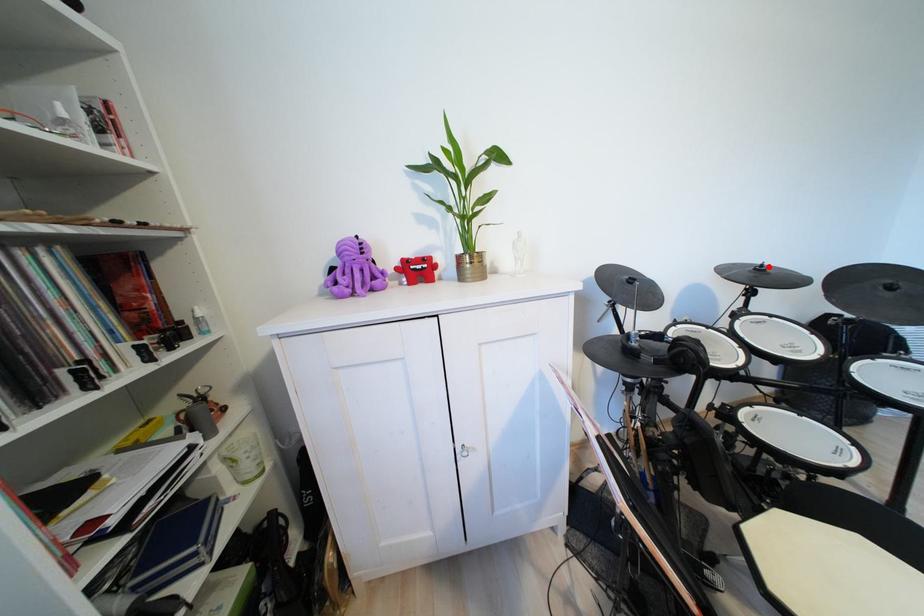
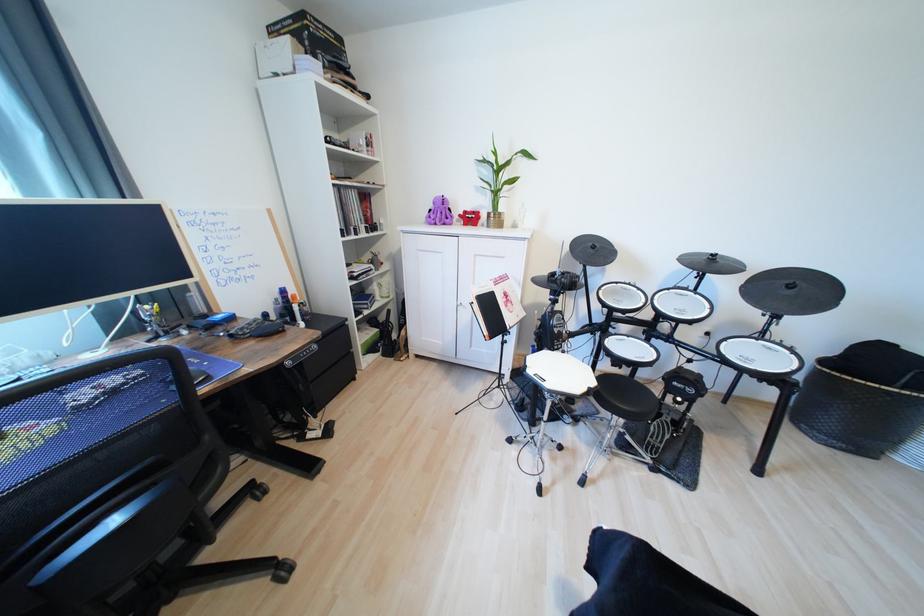
Where in the second image is the point corresponding to the highlighted location from the first image?

(721, 257)